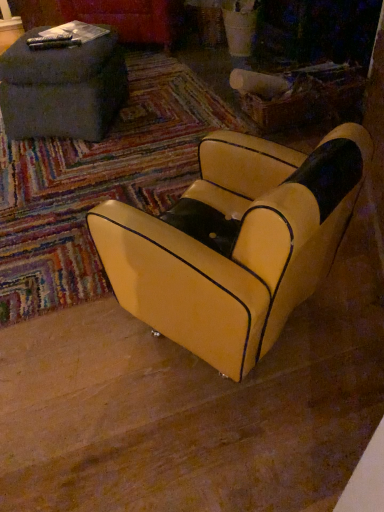
Find the location of a particular element. This screenshot has height=512, width=384. vacant space to the left of yellow leather chair at center is located at coordinates (72, 373).